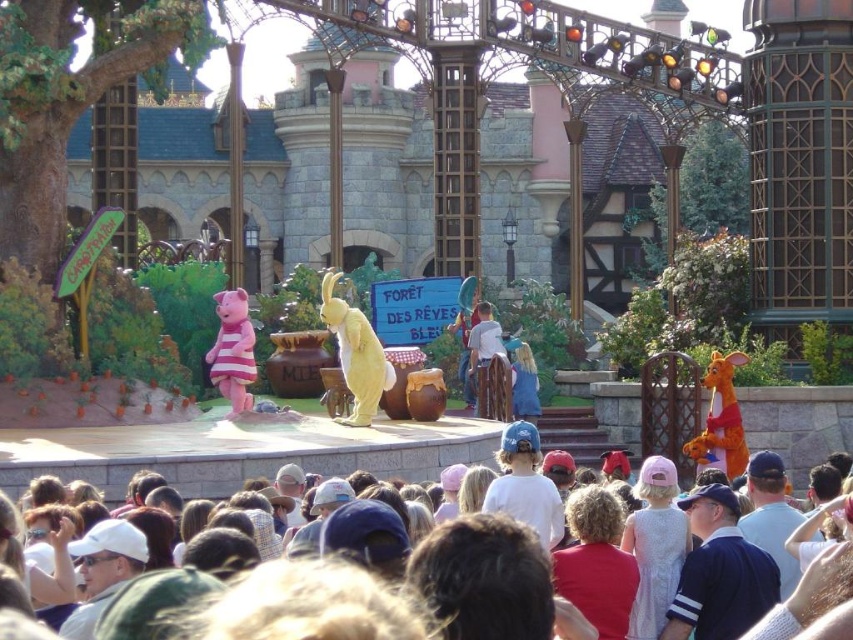
You are standing at the edge of the theme park stage and see the white cotton crowd at lower center and the pink fabric pig at center. Which object is positioned to the right of the other?

The white cotton crowd at lower center is to the right of the pink fabric pig at center.

You are a stagehand preparing to set up a new prop. You need to ensure that the orange plush kangaroo at right is visible to the audience in the white cotton crowd at lower center. Based on their current positions, is the kangaroo likely to be obscured by the crowd?

The white cotton crowd at lower center is much taller than the orange plush kangaroo at right, so the kangaroo is likely to be obscured by the crowd.

You are standing at the camera position and want to see the white cotton crowd at lower center clearly. Considering the crowd is 179.93 feet away, do you think you can easily see individual faces in the crowd from this distance?

The white cotton crowd at lower center is 179.93 feet away from the camera. At this distance, it would be difficult to see individual faces clearly due to the significant distance involved.